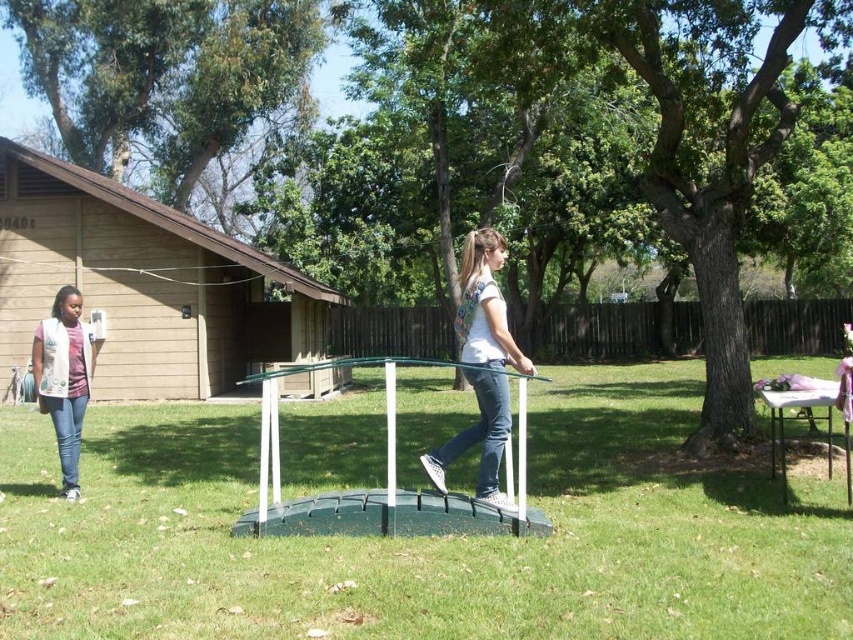
Identify the location of green plastic trampoline at center. pyautogui.click(x=427, y=538).

Who is higher up, green plastic trampoline at center or denim jeans at left?

denim jeans at left is above.

Locate an element on the screen. The height and width of the screenshot is (640, 853). green plastic trampoline at center is located at coordinates (427, 538).

At what (x,y) coordinates should I click in order to perform the action: click on green plastic trampoline at center. Please return your answer as a coordinate pair (x, y). Looking at the image, I should click on (427, 538).

Can you confirm if green plastic trampoline at center is positioned to the left of white matte shirt at center?

Indeed, green plastic trampoline at center is positioned on the left side of white matte shirt at center.

Between green plastic trampoline at center and white matte shirt at center, which one appears on the right side from the viewer's perspective?

From the viewer's perspective, white matte shirt at center appears more on the right side.

Does point (248, 596) come closer to viewer compared to point (505, 397)?

Yes, it is.

This screenshot has width=853, height=640. I want to click on green plastic trampoline at center, so click(427, 538).

Is point (502, 358) positioned behind point (73, 330)?

No.

Is white matte shirt at center wider than denim jeans at left?

Indeed, white matte shirt at center has a greater width compared to denim jeans at left.

At what (x,y) coordinates should I click in order to perform the action: click on white matte shirt at center. Please return your answer as a coordinate pair (x, y). Image resolution: width=853 pixels, height=640 pixels. Looking at the image, I should click on (480, 364).